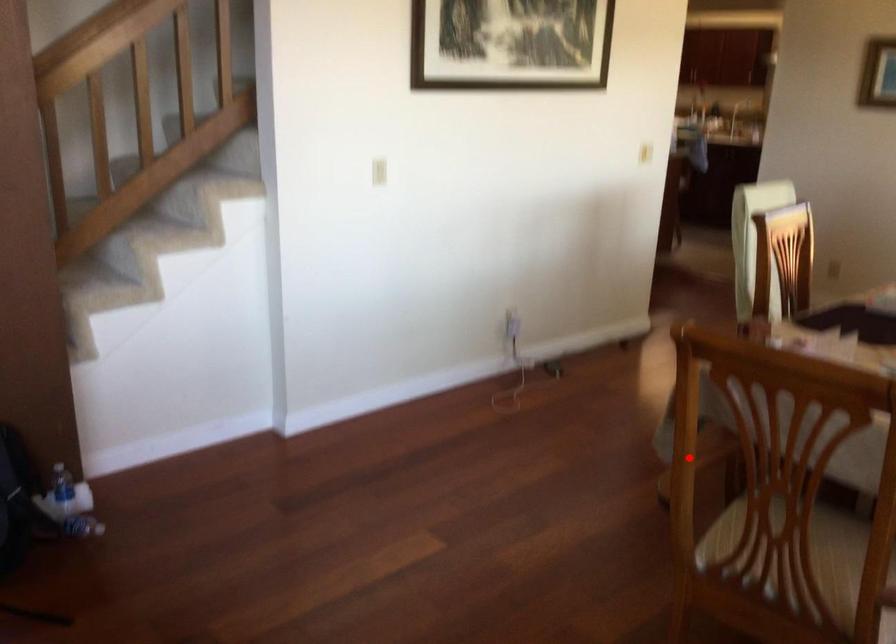
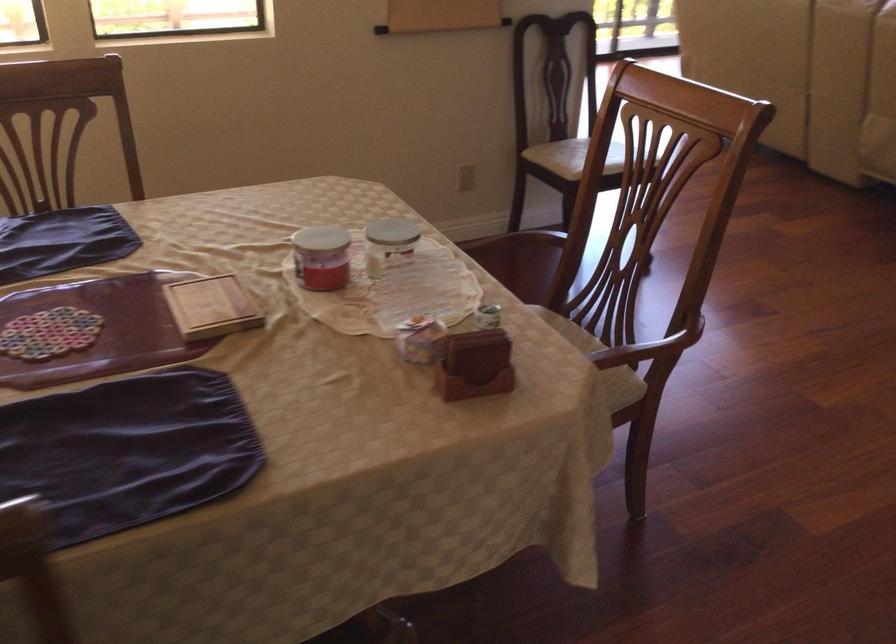
Locate, in the second image, the point that corresponds to the highlighted location in the first image.

(642, 351)